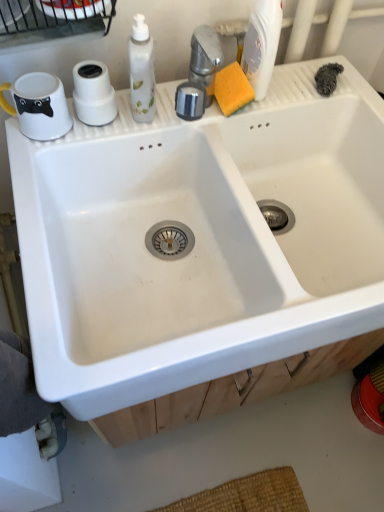
Question: Is white matte toilet paper at upper left at the right side of white plastic bottle at upper right?

Choices:
 (A) no
 (B) yes

Answer: (A)

Question: Is white matte toilet paper at upper left aimed at white plastic bottle at upper right?

Choices:
 (A) yes
 (B) no

Answer: (B)

Question: Does white matte toilet paper at upper left touch white plastic bottle at upper right?

Choices:
 (A) yes
 (B) no

Answer: (B)

Question: Does white matte toilet paper at upper left have a greater height compared to white plastic bottle at upper right?

Choices:
 (A) yes
 (B) no

Answer: (B)

Question: Is white matte toilet paper at upper left thinner than white plastic bottle at upper right?

Choices:
 (A) no
 (B) yes

Answer: (B)

Question: Is white ceramic sink at center situated inside wooden drawer at lower center or outside?

Choices:
 (A) outside
 (B) inside

Answer: (A)

Question: From a real-world perspective, relative to wooden drawer at lower center, is white ceramic sink at center vertically above or below?

Choices:
 (A) above
 (B) below

Answer: (A)

Question: From the image's perspective, is white ceramic sink at center above or below wooden drawer at lower center?

Choices:
 (A) below
 (B) above

Answer: (B)

Question: Is white ceramic sink at center bigger or smaller than wooden drawer at lower center?

Choices:
 (A) big
 (B) small

Answer: (A)

Question: Would you say white ceramic sink at center is to the left or to the right of white matte toilet paper at upper left in the picture?

Choices:
 (A) left
 (B) right

Answer: (B)

Question: Considering the positions of white ceramic sink at center and white matte toilet paper at upper left in the image, is white ceramic sink at center taller or shorter than white matte toilet paper at upper left?

Choices:
 (A) tall
 (B) short

Answer: (A)

Question: From a real-world perspective, is white ceramic sink at center positioned above or below white matte toilet paper at upper left?

Choices:
 (A) above
 (B) below

Answer: (B)

Question: Does point (218, 220) appear closer or farther from the camera than point (87, 69)?

Choices:
 (A) closer
 (B) farther

Answer: (B)

Question: Is white plastic bottle at upper right to the left or to the right of wooden drawer at lower center in the image?

Choices:
 (A) right
 (B) left

Answer: (A)

Question: Considering their positions, is white plastic bottle at upper right located in front of or behind wooden drawer at lower center?

Choices:
 (A) behind
 (B) front

Answer: (B)